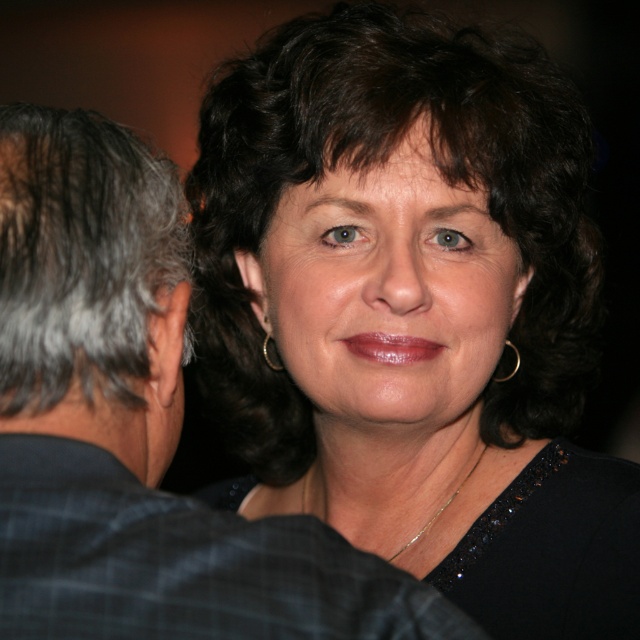
Question: Which of the following is the farthest from the observer?

Choices:
 (A) (508, 344)
 (B) (150, 628)
 (C) (420, 166)
 (D) (56, 285)

Answer: (A)

Question: Among these points, which one is farthest from the camera?

Choices:
 (A) (518, 362)
 (B) (19, 216)
 (C) (77, 168)
 (D) (342, 324)

Answer: (A)

Question: Does black fabric at center have a smaller size compared to plaid fabric shirt at left?

Choices:
 (A) no
 (B) yes

Answer: (A)

Question: Is gray/white hair at left further to camera compared to gold metallic earring at right?

Choices:
 (A) yes
 (B) no

Answer: (B)

Question: Which of the following is the closest to the observer?

Choices:
 (A) (74, 588)
 (B) (593, 312)

Answer: (A)

Question: Does gray/white hair at left appear on the right side of gold metallic earring at right?

Choices:
 (A) yes
 (B) no

Answer: (B)